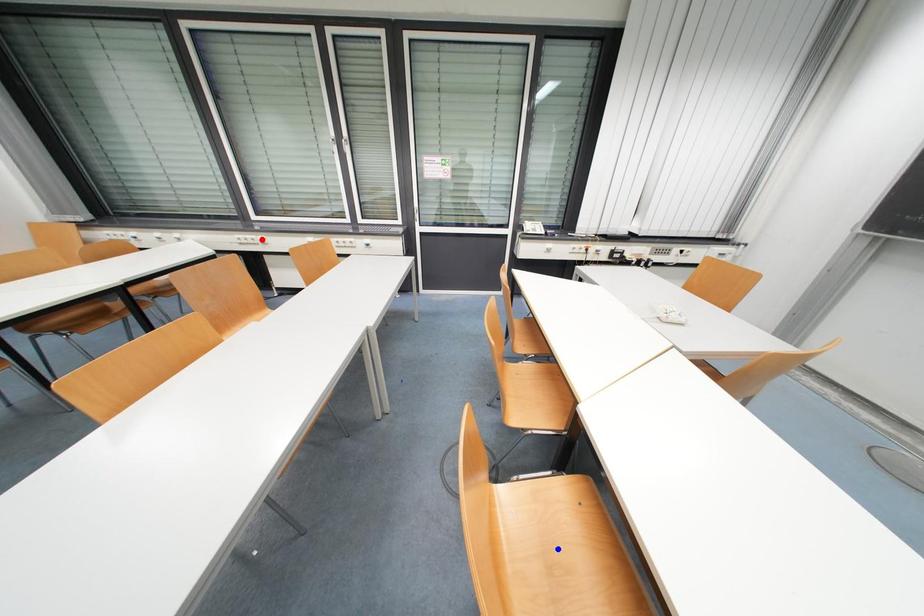
Question: In the image, two points are highlighted. Which point is nearer to the camera? Reply with the corresponding letter.

Choices:
 (A) blue point
 (B) red point

Answer: (A)